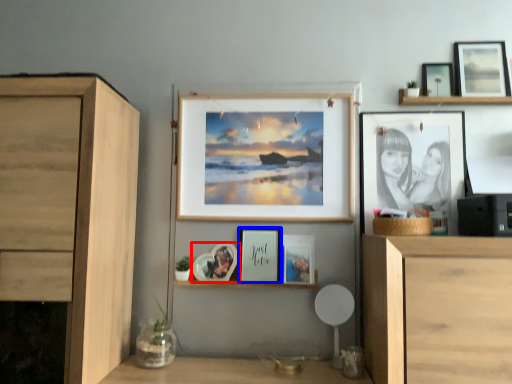
Question: Among these objects, which one is farthest to the camera, picture frame (highlighted by a red box) or picture frame (highlighted by a blue box)?

Choices:
 (A) picture frame
 (B) picture frame

Answer: (B)